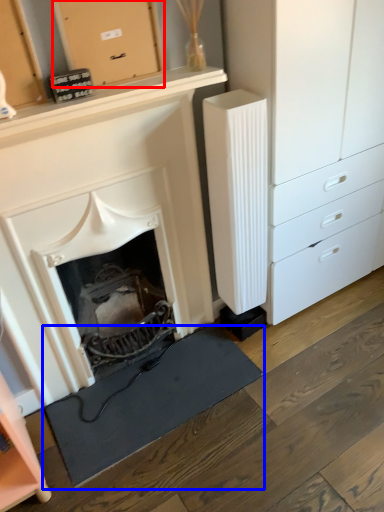
Question: Which point is closer to the camera, cabinetry (highlighted by a red box) or doormat (highlighted by a blue box)?

Choices:
 (A) cabinetry
 (B) doormat

Answer: (A)